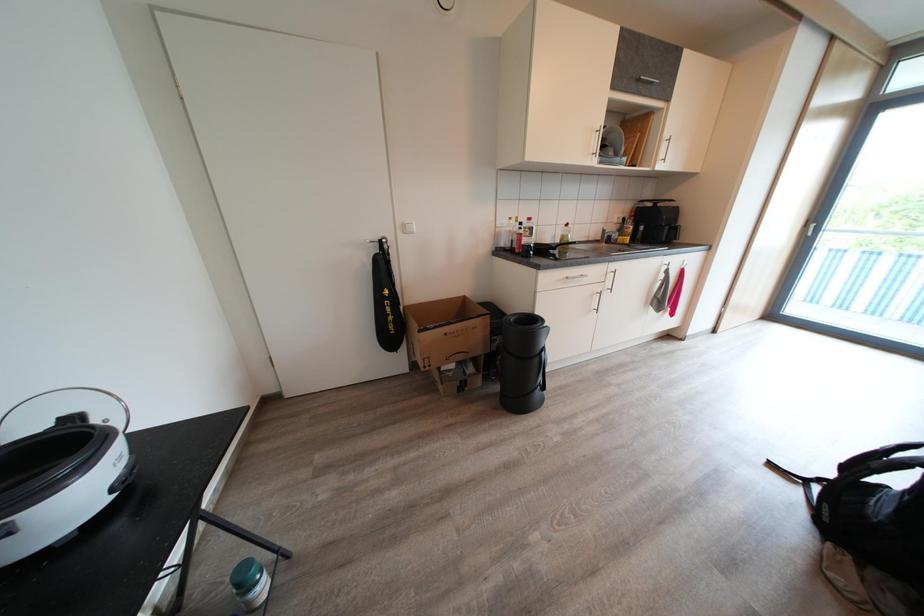
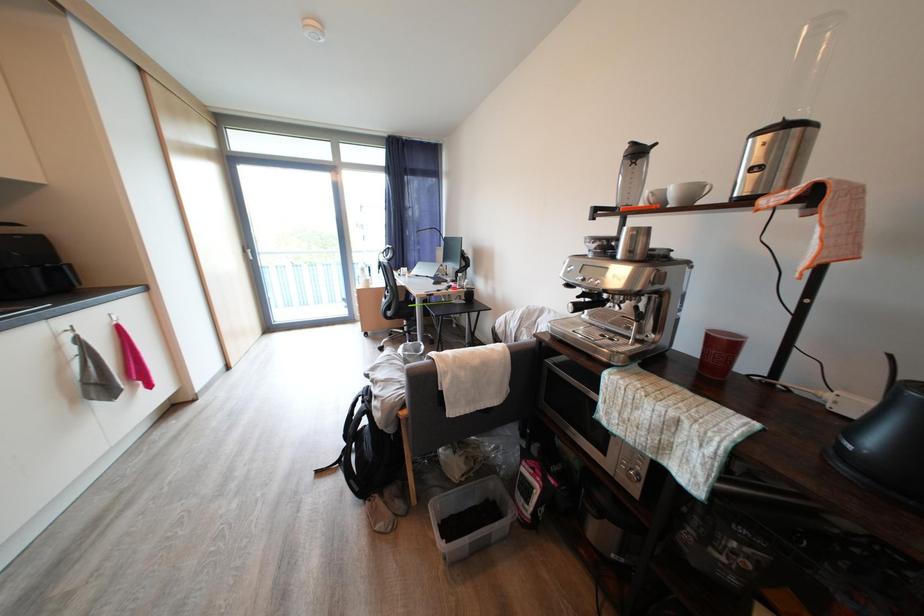
The first image is from the beginning of the video and the second image is from the end. How did the camera likely rotate when shooting the video?

The camera rotated toward right-down.